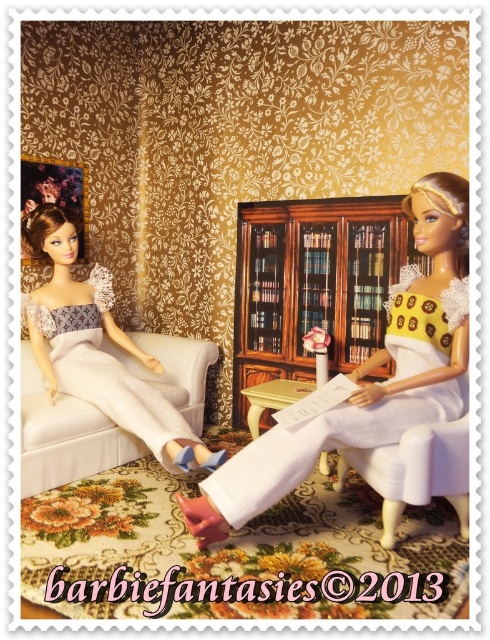
Can you confirm if yellow matte dress at center is positioned above white satin dress at left?

Yes, yellow matte dress at center is above white satin dress at left.

Which of these two, yellow matte dress at center or white satin dress at left, stands shorter?

white satin dress at left is shorter.

Between point (441, 378) and point (78, 374), which one is positioned behind?

The point (78, 374) is more distant.

Find the location of `yellow matte dress at center`. yellow matte dress at center is located at coordinates (366, 376).

Between yellow matte dress at center and woodenmaterial/texturebookshelf at center, which one appears on the left side from the viewer's perspective?

woodenmaterial/texturebookshelf at center is more to the left.

Is point (394, 337) positioned behind point (285, 216)?

No, it is in front of (285, 216).

Is point (289, 483) less distant than point (321, 256)?

That is True.

This screenshot has height=640, width=490. What are the coordinates of `yellow matte dress at center` in the screenshot? It's located at (366, 376).

Looking at this image, which of these two, woodenmaterial/texturebookshelf at center or white satin dress at left, stands shorter?

white satin dress at left

The width and height of the screenshot is (490, 640). Find the location of `woodenmaterial/texturebookshelf at center`. woodenmaterial/texturebookshelf at center is located at coordinates (313, 284).

What do you see at coordinates (313, 284) in the screenshot?
I see `woodenmaterial/texturebookshelf at center` at bounding box center [313, 284].

Where is `woodenmaterial/texturebookshelf at center`? The height and width of the screenshot is (640, 490). woodenmaterial/texturebookshelf at center is located at coordinates point(313,284).